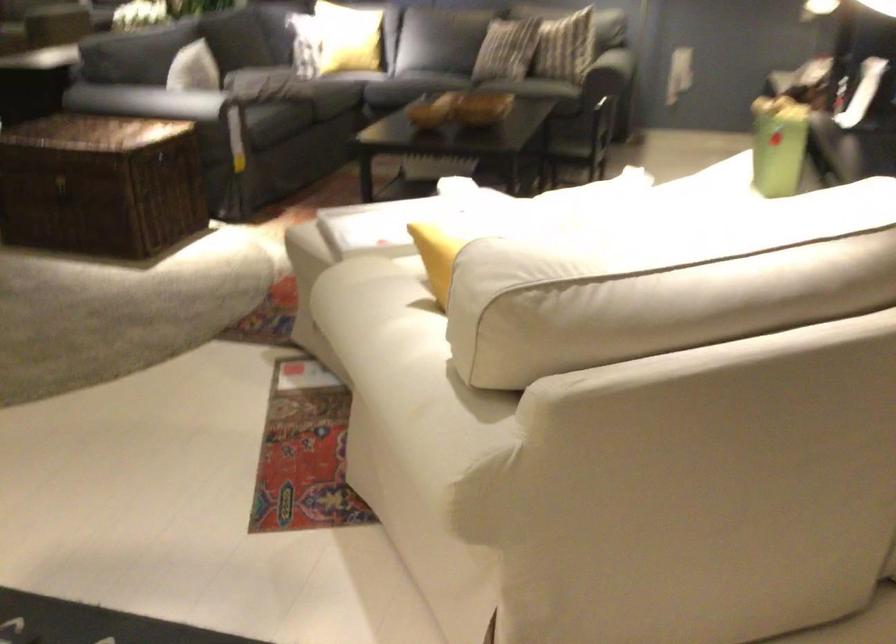
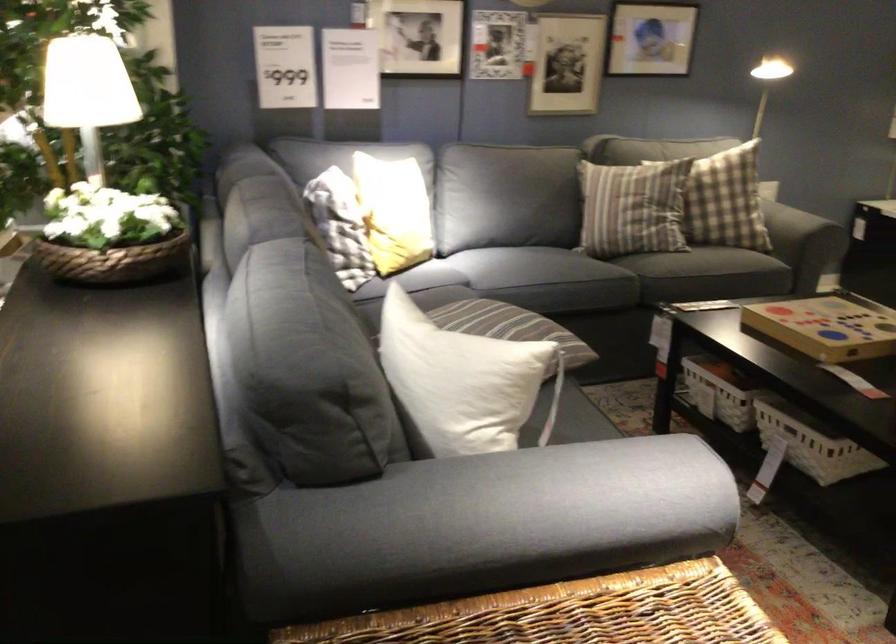
Find the pixel in the second image that matches pixel 179 67 in the first image.

(462, 381)